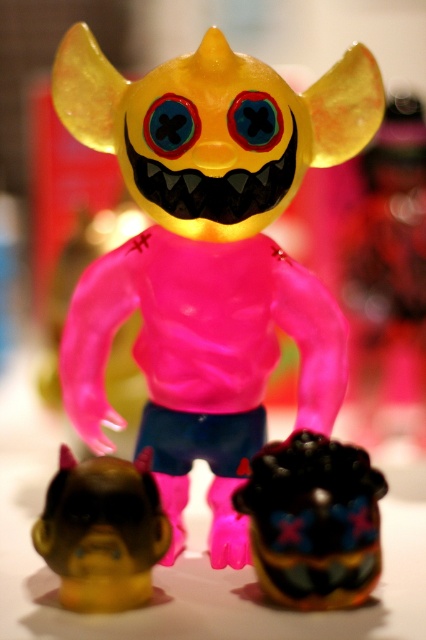
How distant is translucent yellow toy at center from matte black toy head at lower center?

9.37 inches

Does translucent yellow toy at center have a lesser width compared to matte black toy head at lower center?

No.

Which is in front, point (104, 260) or point (291, 544)?

Point (291, 544) is more forward.

You are a GUI agent. You are given a task and a screenshot of the screen. Output one action in this format:
    pyautogui.click(x=<x>, y=<y>)
    Task: Click on the translucent yellow toy at center
    
    Given the screenshot: What is the action you would take?
    pyautogui.click(x=207, y=257)

Which is in front, point (150, 426) or point (106, 547)?

Point (106, 547) is in front.

What do you see at coordinates (207, 257) in the screenshot?
I see `translucent yellow toy at center` at bounding box center [207, 257].

This screenshot has height=640, width=426. Identify the location of translucent yellow toy at center. (207, 257).

How distant is matte black toy head at lower center from brown matte head at lower left?

4.76 inches

I want to click on matte black toy head at lower center, so click(313, 522).